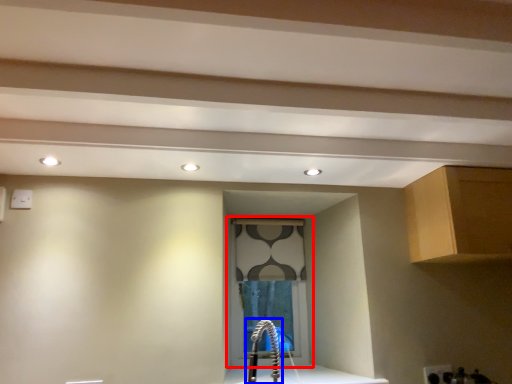
Question: Which point is closer to the camera, window (highlighted by a red box) or faucet (highlighted by a blue box)?

Choices:
 (A) window
 (B) faucet

Answer: (B)